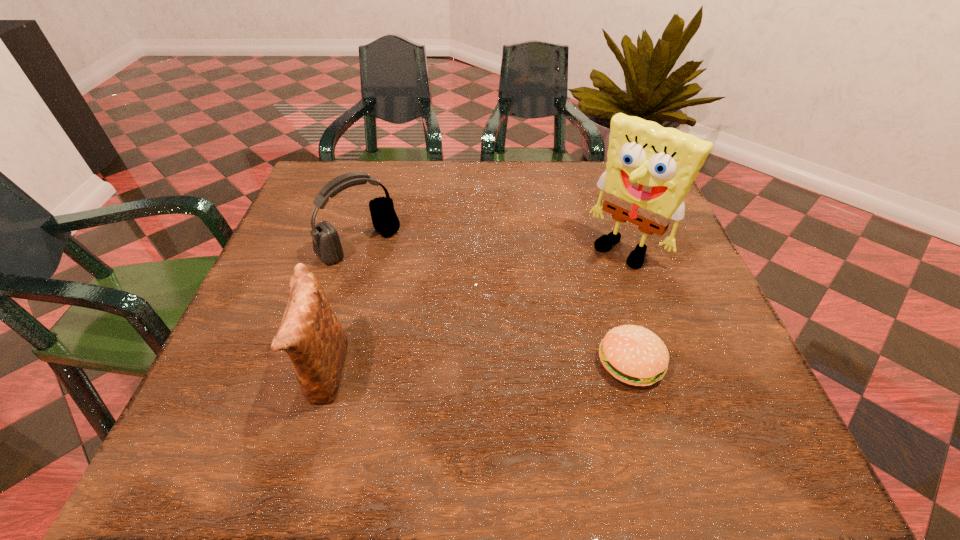
Find the location of a particular element. The height and width of the screenshot is (540, 960). vacant area at the near edge is located at coordinates (470, 408).

In the image, there is a desktop. Where is `free space at the left edge`? This screenshot has height=540, width=960. free space at the left edge is located at coordinates (282, 281).

In the image, there is a desktop. Find the location of `vacant space at the right edge`. vacant space at the right edge is located at coordinates (736, 364).

Image resolution: width=960 pixels, height=540 pixels. I want to click on blank space at the near right corner, so click(669, 370).

Identify the location of free point between the headset and the sponge. (492, 246).

At what (x,y) coordinates should I click in order to perform the action: click on unoccupied position between the clutch bag and the headset. Please return your answer as a coordinate pair (x, y). This screenshot has height=540, width=960. Looking at the image, I should click on point(342,309).

Where is `empty location between the clutch bag and the tallest object`? The height and width of the screenshot is (540, 960). empty location between the clutch bag and the tallest object is located at coordinates (474, 310).

I want to click on free spot between the shortest object and the tallest object, so click(628, 305).

This screenshot has width=960, height=540. Find the location of `empty space that is in between the patty and the headset`. empty space that is in between the patty and the headset is located at coordinates (495, 303).

Locate an element on the screen. The image size is (960, 540). blank region between the headset and the clutch bag is located at coordinates (342, 309).